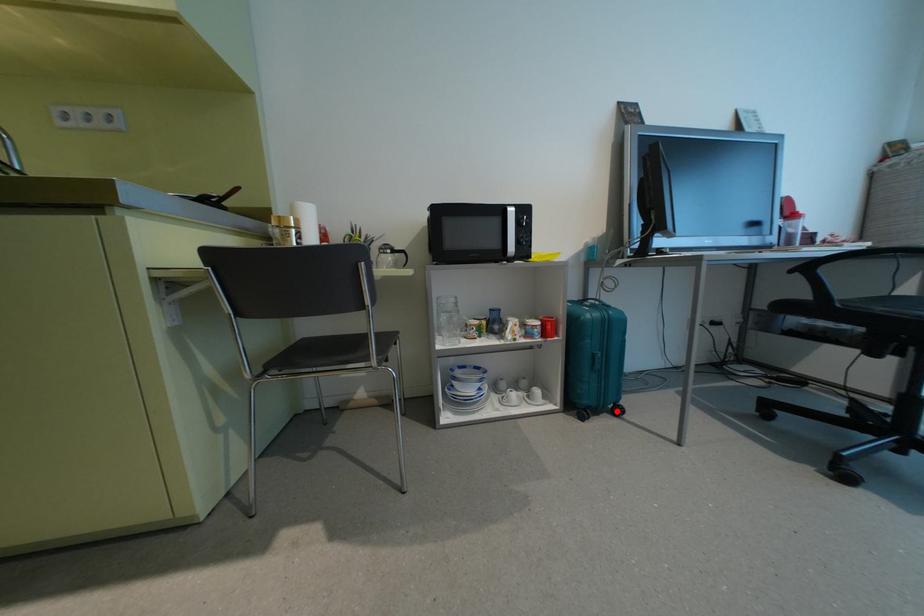
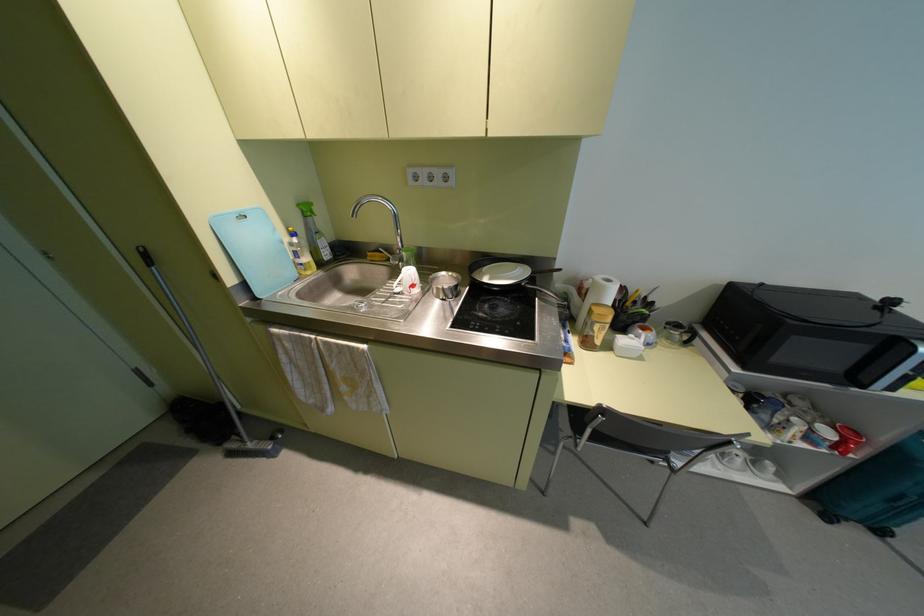
Question: I am providing you with two images of the same scene from different viewpoints. A red point is shown in image1. For the corresponding object point in image2, is it positioned nearer or farther from the camera?

Choices:
 (A) Nearer
 (B) Farther

Answer: (A)